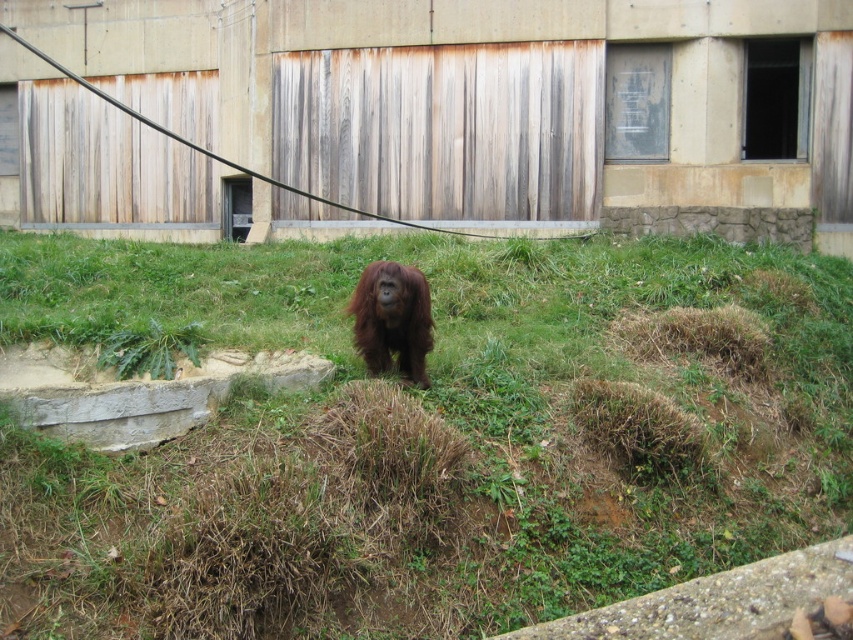
You are standing at the point labeled point (x=498, y=493) and want to walk to the point labeled point (x=381, y=342). Which direction should you go to get closer to your destination?

You should move away from the viewer to reach point (x=381, y=342) since it is farther away than point (x=498, y=493).

You are a zookeeper trying to determine the best path for the orangutan to walk without stepping on dry patches. Given the presence of the green grassy at center and the brown furry orangutan at center, which area is wider and thus safer for the orangutan to traverse?

The green grassy at center has a larger width than the brown furry orangutan at center, so the orangutan can safely walk on the green grassy at center as it provides a wider path.